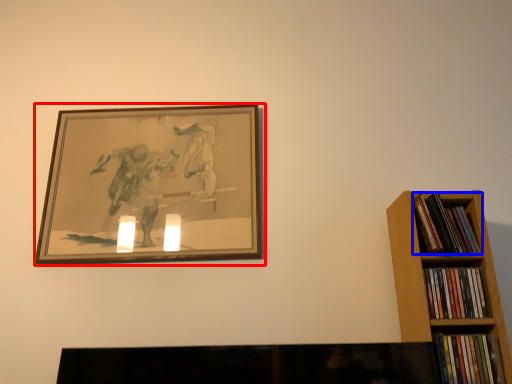
Question: Which object is closer to the camera taking this photo, picture frame (highlighted by a red box) or book (highlighted by a blue box)?

Choices:
 (A) picture frame
 (B) book

Answer: (B)